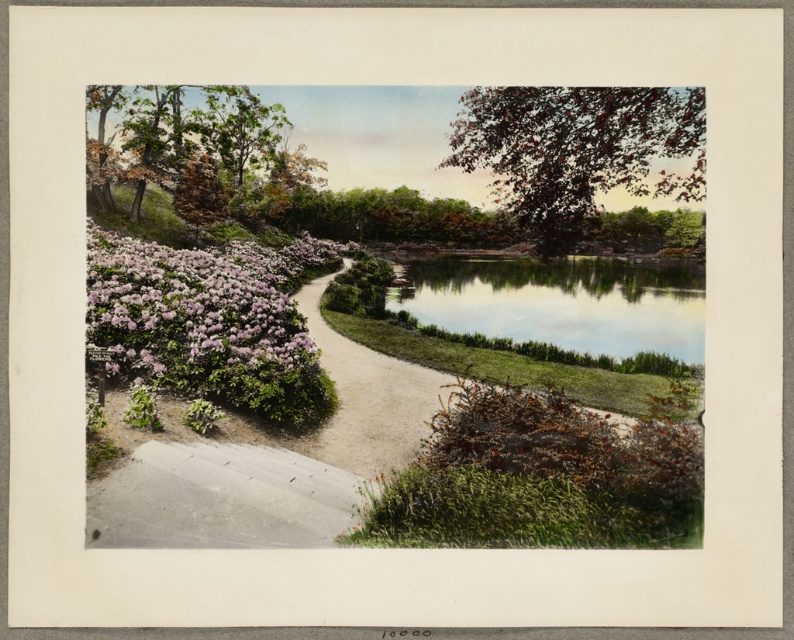
Between pink matte flowers at left and sandy gravel path at center, which one appears on the left side from the viewer's perspective?

pink matte flowers at left is more to the left.

Which of these two, pink matte flowers at left or sandy gravel path at center, stands shorter?

sandy gravel path at center

Between point (153, 323) and point (397, 442), which one is positioned behind?

Positioned behind is point (153, 323).

This screenshot has width=794, height=640. I want to click on pink matte flowers at left, so click(x=199, y=305).

Who is shorter, smooth brown tree at upper right or sandy gravel path at center?

sandy gravel path at center

Is smooth brown tree at upper right bigger than sandy gravel path at center?

Yes.

Which is behind, point (545, 209) or point (330, 333)?

The point (330, 333) is more distant.

Identify the location of smooth brown tree at upper right. The width and height of the screenshot is (794, 640). (576, 150).

Is brown textured tree at upper left bigger than sandy gravel path at center?

Correct, brown textured tree at upper left is larger in size than sandy gravel path at center.

Does brown textured tree at upper left appear over sandy gravel path at center?

Correct, brown textured tree at upper left is located above sandy gravel path at center.

Which is in front, point (130, 173) or point (318, 321)?

Point (318, 321) is in front.

At what (x,y) coordinates should I click in order to perform the action: click on brown textured tree at upper left. Please return your answer as a coordinate pair (x, y). This screenshot has height=640, width=794. Looking at the image, I should click on (195, 152).